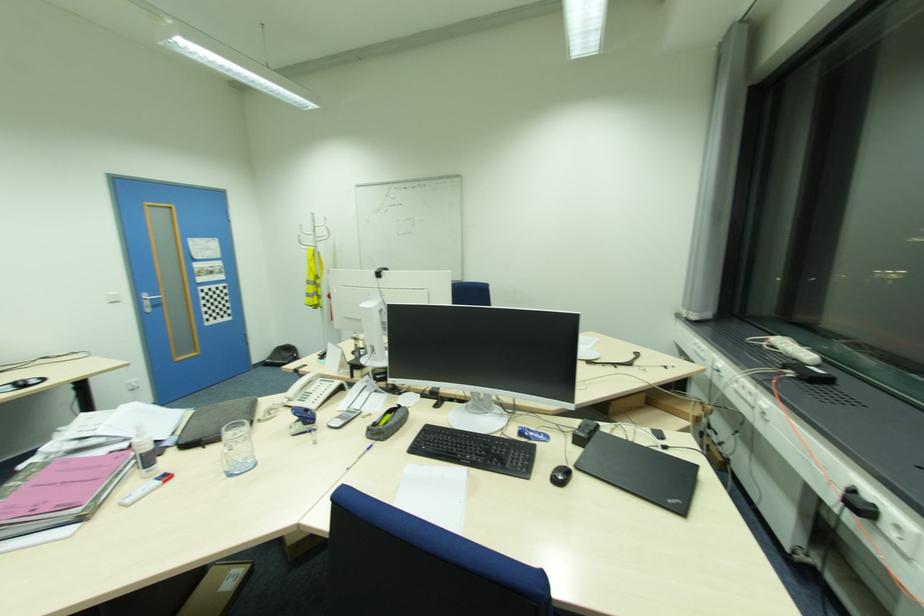
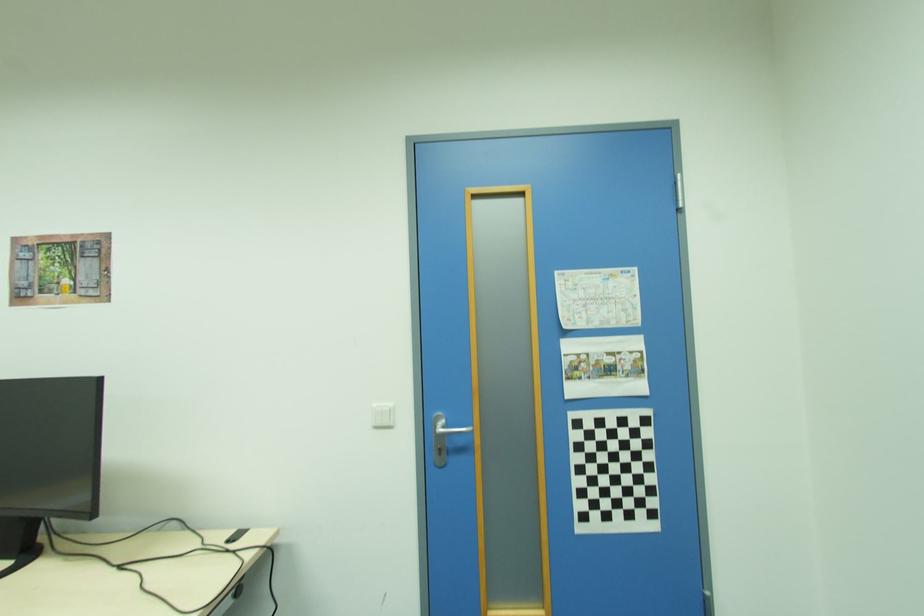
Where in the second image is the point corresponding to (x=207, y=257) from the first image?

(599, 325)